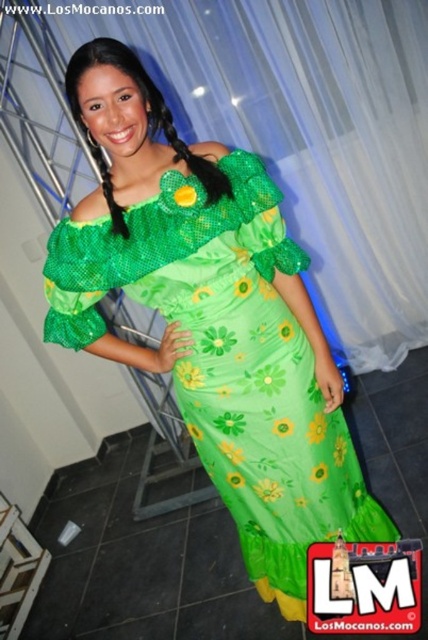
You are a photographer setting up for a photoshoot. You need to ensure that the green satin dress at center is fully visible in the frame without being obscured by the translucent white curtain at upper center. Given their widths, is this possible?

The translucent white curtain at upper center is wider than the green satin dress at center. Since the curtain is wider, it could potentially cover more of the dress if positioned in front, but since the dress is at center and the curtain is at upper center, the vertical placement might allow the dress to be visible below the curtain. However, the question specifically asks about width. Since the curtain is wider, if aligned horizontally, it might still obscure parts of the dress unless the camera angle or

You are a photographer setting up a shoot. You need to decide whether the translucent white curtain at upper center can be used as a backdrop for the green satin dress at center. Based on their sizes, will the curtain be sufficient to cover the background behind the dress?

The translucent white curtain at upper center has a larger size compared to green satin dress at center, so it should be sufficient to cover the background behind the dress as a backdrop.

You are a photographer setting up for a photoshoot. You need to ensure that the translucent white curtain at upper center and the green satin dress at center are both visible in the frame. Given that the curtain is taller than the dress, which object will you need to adjust the camera angle to capture fully?

The translucent white curtain at upper center has a greater height compared to the green satin dress at center, so you will need to adjust the camera angle to capture the full height of the translucent white curtain at upper center.